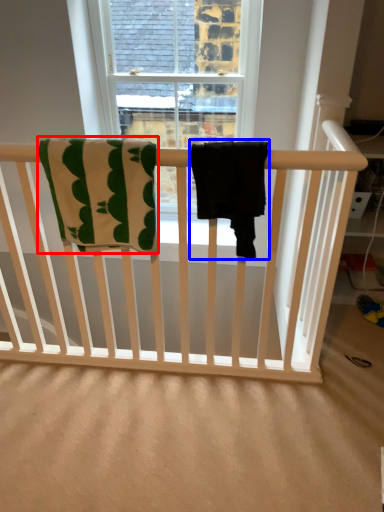
Question: Which point is closer to the camera, beach towel (highlighted by a red box) or beach towel (highlighted by a blue box)?

Choices:
 (A) beach towel
 (B) beach towel

Answer: (B)